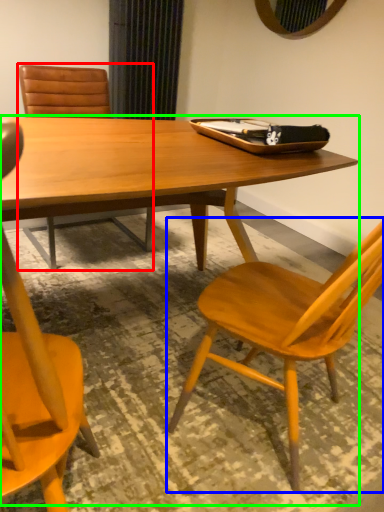
Question: Which object is positioned farthest from chair (highlighted by a red box)? Select from chair (highlighted by a blue box) and round table (highlighted by a green box).

Choices:
 (A) chair
 (B) round table

Answer: (A)